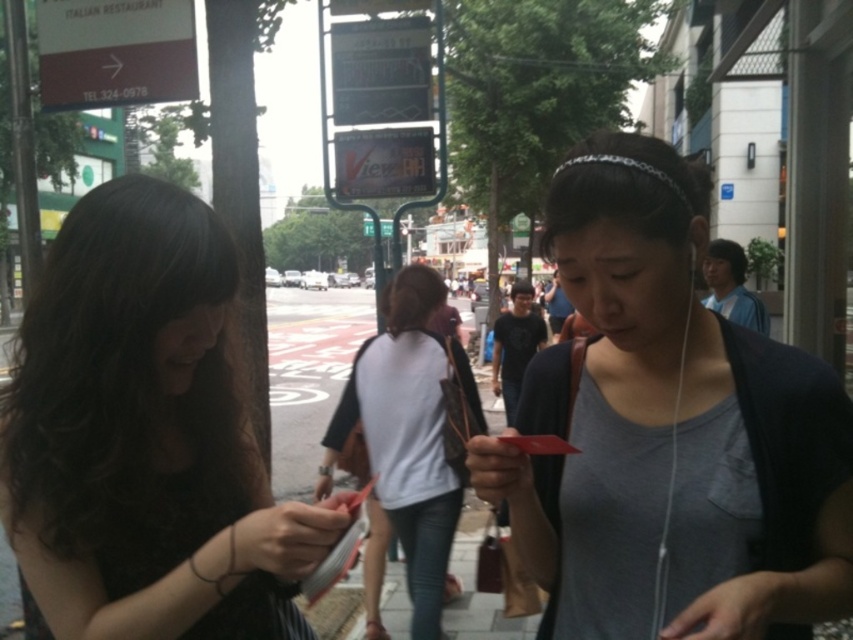
Based on the photo, you are a photographer standing in the middle of the street. You want to take a photo of both the dark brown hair at left and the gray matte tank top at center. Which object should you focus on first to ensure both are in clear view?

You should focus on the dark brown hair at left first because it is closer to you than the gray matte tank top at center, ensuring both are in clear view.